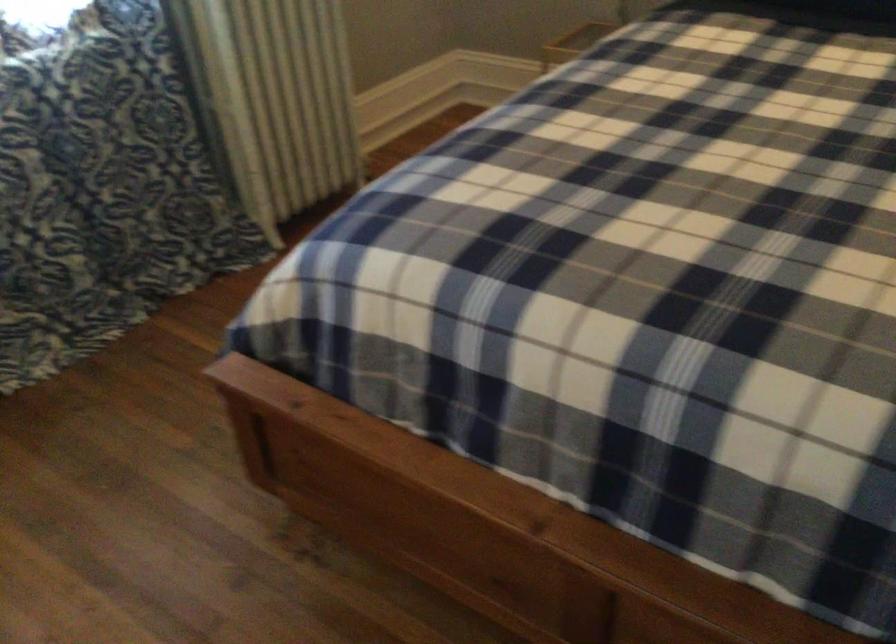
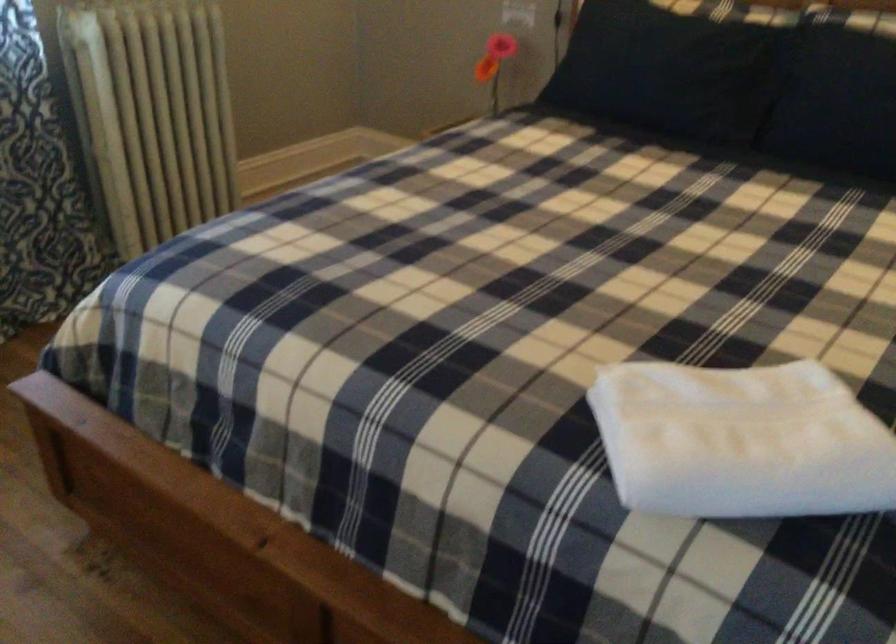
The images are taken continuously from a first-person perspective. In which direction are you moving?

The movement direction of the cameraman is right, backward.